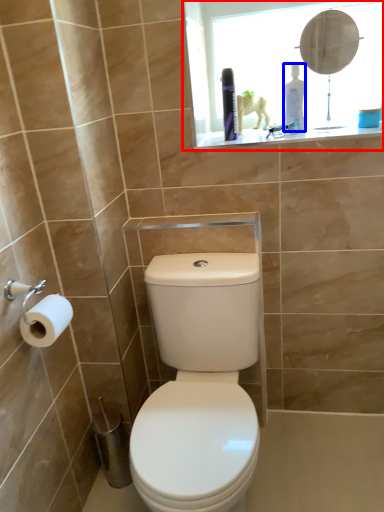
Question: Among these objects, which one is nearest to the camera, medicine cabinet (highlighted by a red box) or toiletry (highlighted by a blue box)?

Choices:
 (A) medicine cabinet
 (B) toiletry

Answer: (A)